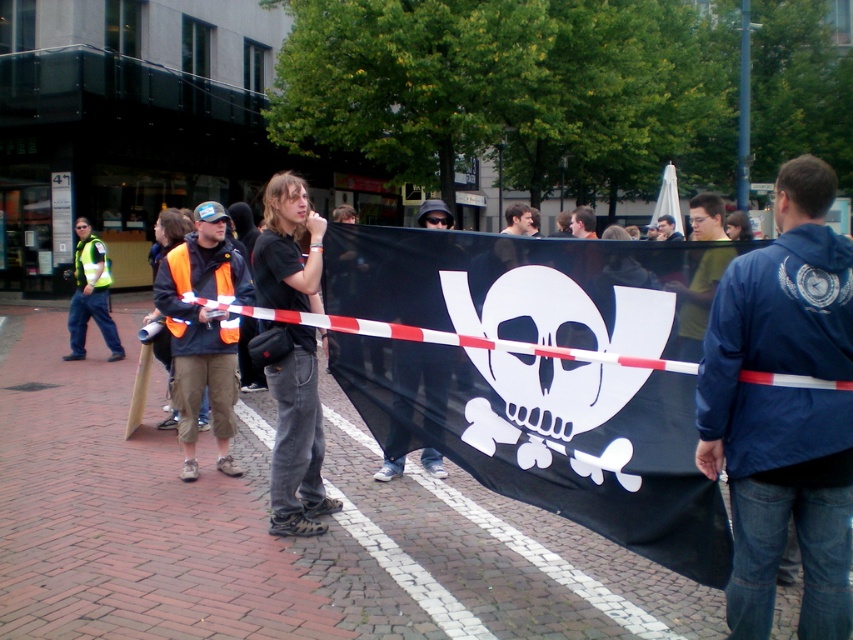
You are a photographer trying to capture the protest scene. You notice the black fabric banner at center and the reflective orange vest at center. Which object is closer to the camera based on their positions?

The reflective orange vest at center is closer to the camera because the black fabric banner at center is positioned under it.